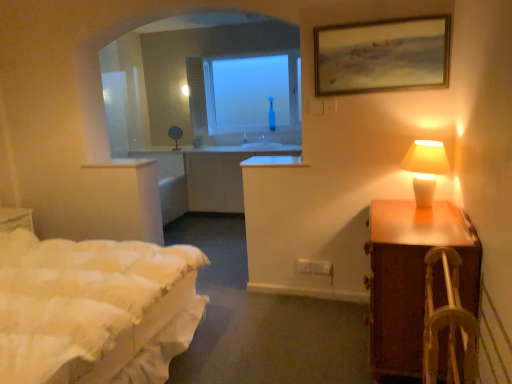
Question: Can you confirm if white ceramic lamp at right is taller than brown wooden nightstand at right?

Choices:
 (A) no
 (B) yes

Answer: (A)

Question: From the image's perspective, is white ceramic lamp at right under brown wooden nightstand at right?

Choices:
 (A) yes
 (B) no

Answer: (B)

Question: Would you consider white ceramic lamp at right to be distant from brown wooden nightstand at right?

Choices:
 (A) yes
 (B) no

Answer: (B)

Question: Considering the relative sizes of white ceramic lamp at right and brown wooden nightstand at right in the image provided, is white ceramic lamp at right wider than brown wooden nightstand at right?

Choices:
 (A) no
 (B) yes

Answer: (A)

Question: Can you confirm if white ceramic lamp at right is positioned to the right of brown wooden nightstand at right?

Choices:
 (A) yes
 (B) no

Answer: (A)

Question: From a real-world perspective, is white ceramic lamp at right positioned under brown wooden nightstand at right based on gravity?

Choices:
 (A) no
 (B) yes

Answer: (A)

Question: From a real-world perspective, is transparent glass window at center physically above brown wooden nightstand at right?

Choices:
 (A) yes
 (B) no

Answer: (A)

Question: Does transparent glass window at center have a lesser height compared to brown wooden nightstand at right?

Choices:
 (A) no
 (B) yes

Answer: (A)

Question: Is transparent glass window at center next to brown wooden nightstand at right and touching it?

Choices:
 (A) yes
 (B) no

Answer: (B)

Question: Is transparent glass window at center thinner than brown wooden nightstand at right?

Choices:
 (A) yes
 (B) no

Answer: (A)

Question: Is transparent glass window at center in front of brown wooden nightstand at right?

Choices:
 (A) yes
 (B) no

Answer: (B)

Question: Does transparent glass window at center have a smaller size compared to brown wooden nightstand at right?

Choices:
 (A) yes
 (B) no

Answer: (A)

Question: Does wooden framed painting at upper right come in front of brown wooden nightstand at right?

Choices:
 (A) no
 (B) yes

Answer: (A)